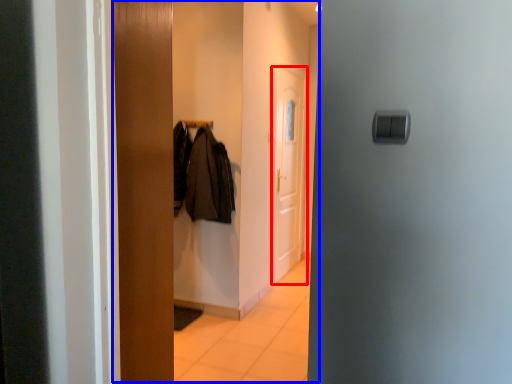
Question: Which of the following is the closest to the observer, door (highlighted by a red box) or dresser (highlighted by a blue box)?

Choices:
 (A) door
 (B) dresser

Answer: (B)